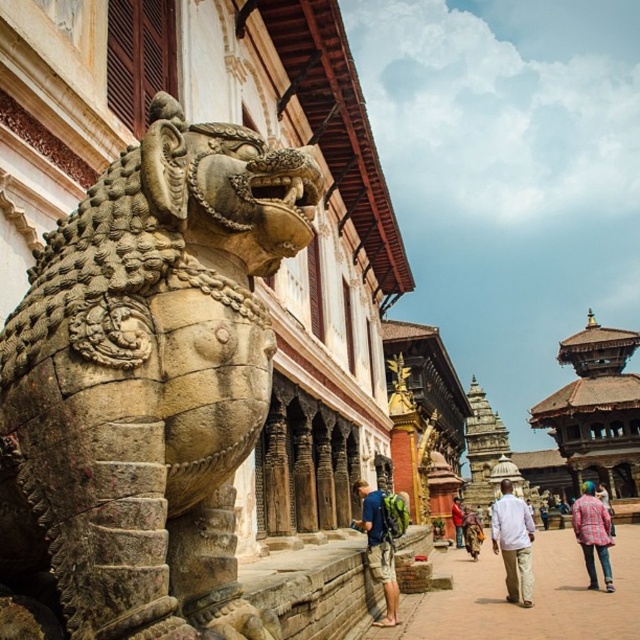
Question: Which point appears closest to the camera in this image?

Choices:
 (A) (452, 524)
 (B) (602, 528)

Answer: (B)

Question: Is white cotton shirt at center to the left of red plaid shirt at center from the viewer's perspective?

Choices:
 (A) no
 (B) yes

Answer: (A)

Question: Which of the following is the farthest from the observer?

Choices:
 (A) brown stone pagoda at center
 (B) blue fabric backpack at lower center

Answer: (A)

Question: Can you confirm if white cotton shirt at center is bigger than red plaid shirt at center?

Choices:
 (A) no
 (B) yes

Answer: (B)

Question: Among these objects, which one is nearest to the camera?

Choices:
 (A) blue fabric backpack at lower center
 (B) stone textured lion at left
 (C) red plaid shirt at center

Answer: (B)

Question: Does blue fabric backpack at lower center appear under plaid shirt at lower right?

Choices:
 (A) yes
 (B) no

Answer: (B)